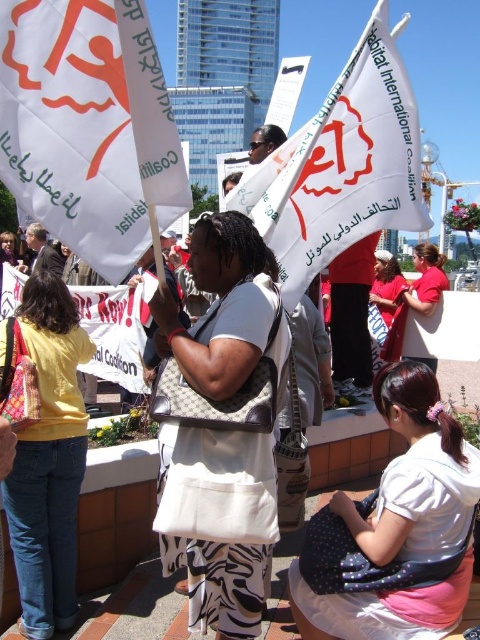
Question: Which of the following is the farthest from the observer?

Choices:
 (A) white fabric flag at upper center
 (B) white canvas bag at center
 (C) white fabric flag at center

Answer: (C)

Question: Among these objects, which one is farthest from the camera?

Choices:
 (A) matte red shirt at center
 (B) white canvas bag at center
 (C) white dotted fabric at lower right
 (D) white fabric flag at upper center

Answer: (A)

Question: Where is white dotted fabric at lower right located in relation to matte red shirt at center in the image?

Choices:
 (A) above
 (B) below

Answer: (B)

Question: Which point is closer to the camera?

Choices:
 (A) denim jeans at lower left
 (B) white paper flag at upper center

Answer: (A)

Question: Is white fabric flag at upper center to the left of white fabric flag at center from the viewer's perspective?

Choices:
 (A) yes
 (B) no

Answer: (B)

Question: Can you confirm if white canvas bag at center is positioned to the left of white fabric flag at center?

Choices:
 (A) no
 (B) yes

Answer: (A)